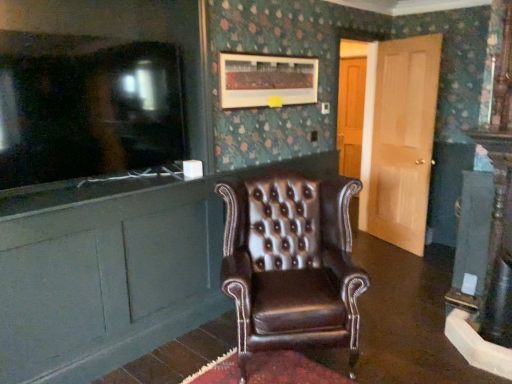
In order to click on free space in front of light brown wood door at right in this screenshot , I will do `click(401, 267)`.